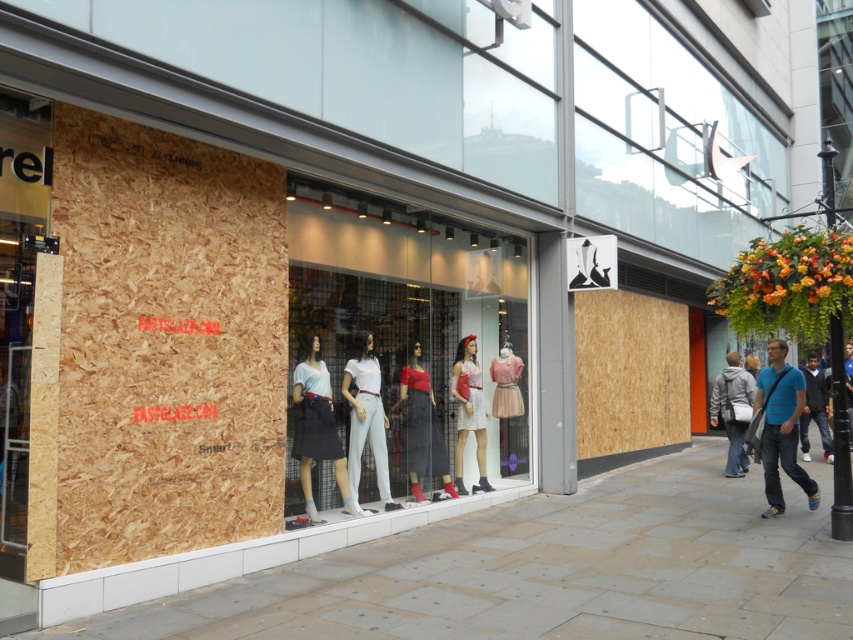
Question: Which object is positioned closest to the matte pink dress at center?

Choices:
 (A) blue striped shirt at lower right
 (B) matte white t-shirt at center

Answer: (B)

Question: Is white matte t-shirt at center to the left of dark blue jeans at lower right from the viewer's perspective?

Choices:
 (A) no
 (B) yes

Answer: (B)

Question: Observing the image, what is the correct spatial positioning of matte glass mannequins at center in reference to matte red blouse at center?

Choices:
 (A) right
 (B) left

Answer: (A)

Question: Is the position of smooth concrete pavement at center less distant than that of matte pink dress at center?

Choices:
 (A) yes
 (B) no

Answer: (A)

Question: Among these points, which one is nearest to the camera?

Choices:
 (A) (518, 372)
 (B) (463, 337)
 (C) (514, 472)

Answer: (B)

Question: Which point appears farthest from the camera in this image?

Choices:
 (A) (410, 490)
 (B) (502, 428)
 (C) (523, 348)

Answer: (B)